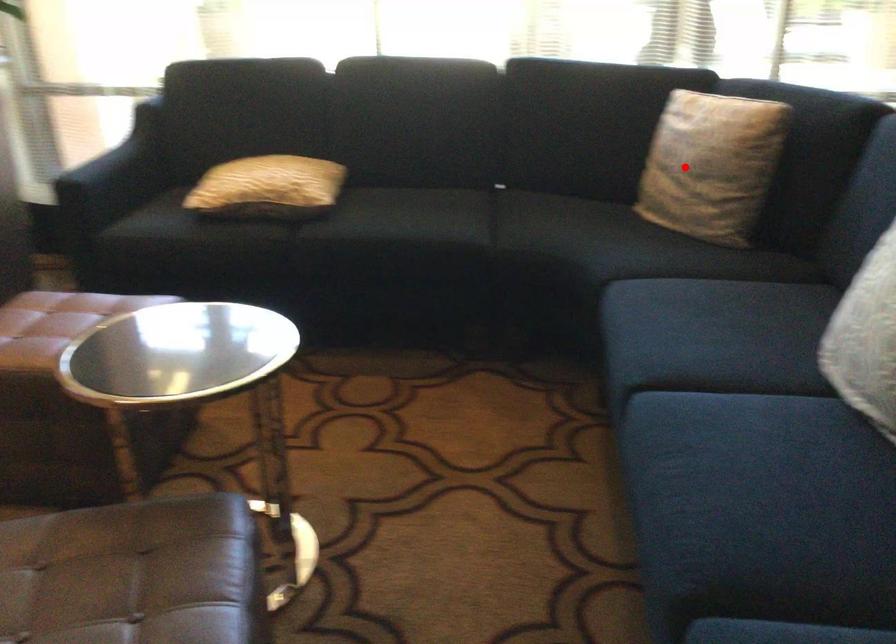
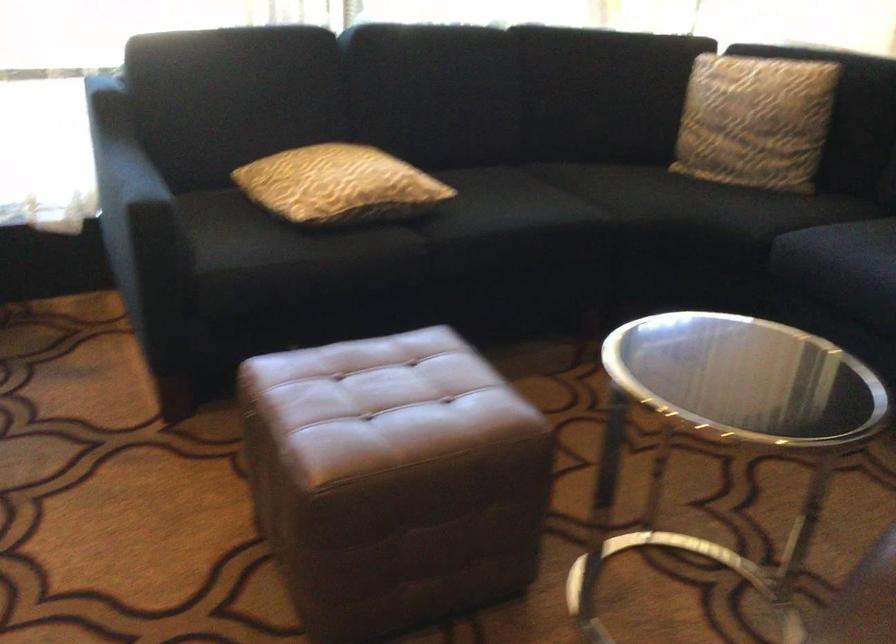
Where in the second image is the point corresponding to the highlighted location from the first image?

(754, 120)